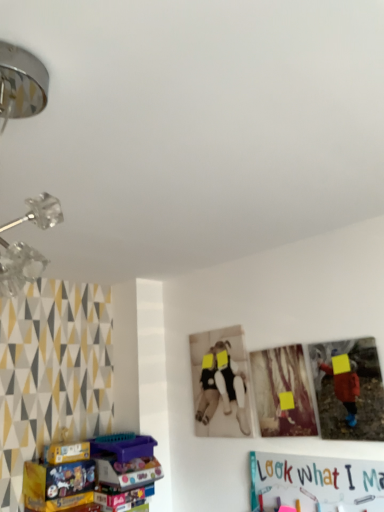
Question: Looking at their shapes, would you say matte cardboard box at lower left is wider or thinner than metallic chrome lamp at upper left?

Choices:
 (A) wide
 (B) thin

Answer: (A)

Question: In terms of size, does matte cardboard box at lower left appear bigger or smaller than metallic chrome lamp at upper left?

Choices:
 (A) small
 (B) big

Answer: (A)

Question: Which object is positioned closest to the matte plastic picture frame at right, which is the 2th picture frame in left-to-right order?

Choices:
 (A) metallic chrome lamp at upper left
 (B) wooden photo frame at center, which is counted as the second picture frame, starting from the right
 (C) matte cardboard box at lower left

Answer: (B)

Question: Which of these objects is positioned closest to the metallic chrome lamp at upper left?

Choices:
 (A) wooden photo frame at center, which is counted as the second picture frame, starting from the right
 (B) matte plastic picture frame at right, which is the 1th picture frame from right to left
 (C) matte cardboard box at lower left

Answer: (B)